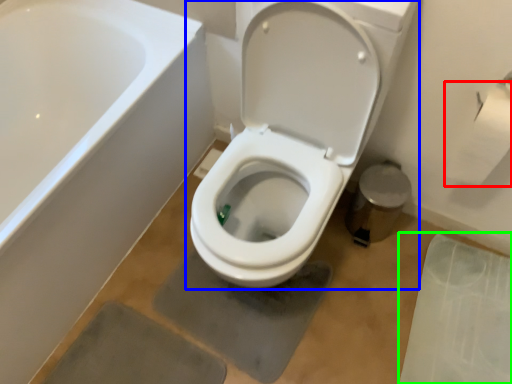
Question: Which object is the farthest from toilet paper (highlighted by a red box)? Choose among these: toilet (highlighted by a blue box) or concrete (highlighted by a green box).

Choices:
 (A) toilet
 (B) concrete

Answer: (B)